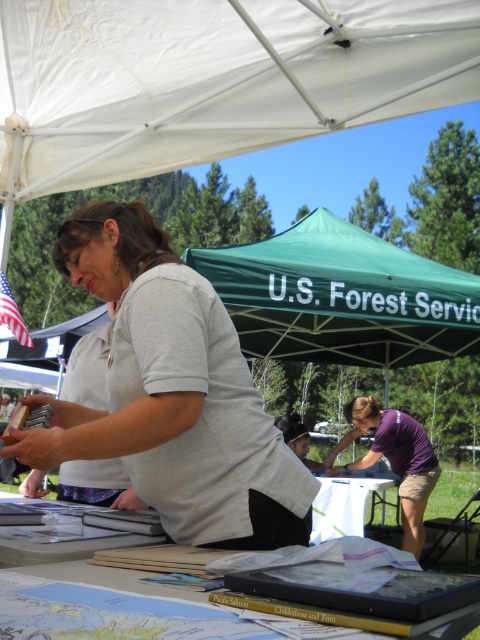
From the picture: You are a participant at the event and need to hang a small decoration. The decoration requires a hook that is higher than the white paper at center. Can you hang it under the green fabric canopy at center?

The green fabric canopy at center is much taller than the white paper at center, so yes, you can hang the decoration under the green fabric canopy at center as there is enough vertical space above the white paper at center.

You are a photographer standing 1.5 meters away from the gray matte shirt at center. Can you take a clear photo of it without moving closer?

The gray matte shirt at center is 1.12 meters away from the viewer, so since you are standing 1.5 meters away, you are actually farther than the shirt, meaning you can still take a clear photo without moving closer.